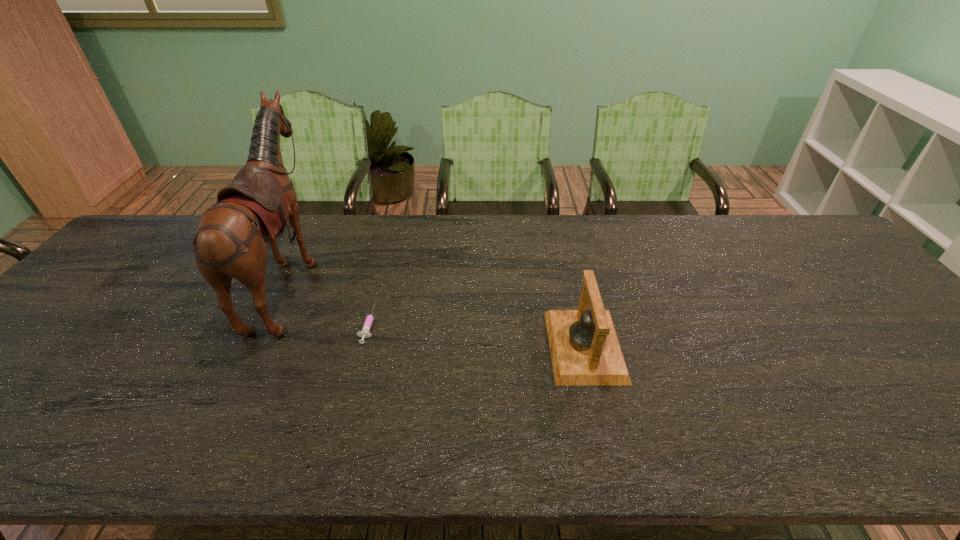
At what (x,y) coordinates should I click in order to perform the action: click on free space between the leftmost object and the shortest object. Please return your answer as a coordinate pair (x, y). Looking at the image, I should click on (330, 302).

The height and width of the screenshot is (540, 960). I want to click on free area in between the syringe and the saddle, so click(x=330, y=302).

Where is `vacant space in between the second shortest object and the shortest object`? The image size is (960, 540). vacant space in between the second shortest object and the shortest object is located at coordinates (476, 335).

Where is `vacant space that's between the rightmost object and the tallest object`? The height and width of the screenshot is (540, 960). vacant space that's between the rightmost object and the tallest object is located at coordinates (438, 313).

Identify the location of object that can be found as the closest to the shortest object. This screenshot has height=540, width=960. (257, 205).

Where is `object that is the second closest to the syringe`? This screenshot has width=960, height=540. object that is the second closest to the syringe is located at coordinates (585, 351).

You are a GUI agent. You are given a task and a screenshot of the screen. Output one action in this format:
    pyautogui.click(x=<x>, y=<y>)
    Task: Click on the blank space that satisfies the following two spatial constraints: 1. on the back of the tallest object; 2. on the left side of the second object from right to left
    Image resolution: width=960 pixels, height=540 pixels.
    Given the screenshot: What is the action you would take?
    pyautogui.click(x=270, y=324)

Image resolution: width=960 pixels, height=540 pixels. I want to click on blank area in the image that satisfies the following two spatial constraints: 1. on the front side of the bell; 2. on the right side of the syringe, so click(x=363, y=346).

This screenshot has height=540, width=960. Find the location of `vacant space that satisfies the following two spatial constraints: 1. on the back side of the second shortest object; 2. on the back of the saddle`. vacant space that satisfies the following two spatial constraints: 1. on the back side of the second shortest object; 2. on the back of the saddle is located at coordinates (569, 280).

The height and width of the screenshot is (540, 960). Find the location of `vacant space that satisfies the following two spatial constraints: 1. on the back of the bell; 2. on the right side of the leftmost object`. vacant space that satisfies the following two spatial constraints: 1. on the back of the bell; 2. on the right side of the leftmost object is located at coordinates (259, 346).